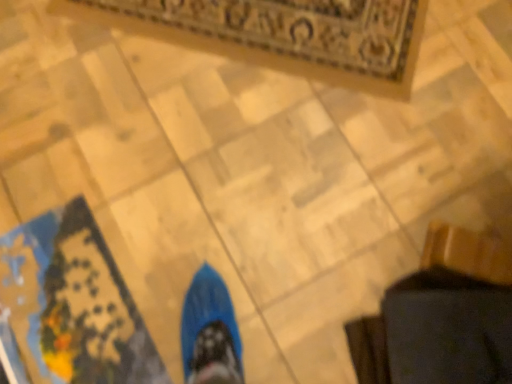
What do you see at coordinates (71, 305) in the screenshot? This screenshot has height=384, width=512. I see `blue fabric mat at lower left, placed as the second mat when sorted from back to front` at bounding box center [71, 305].

In order to face blue fabric mat at lower left, which appears as the first mat when ordered from the bottom, should I rotate leftwards or rightwards?

You should rotate left by 23.453 degrees.

Where is `blue fabric mat at lower left, acting as the first mat starting from the front`? blue fabric mat at lower left, acting as the first mat starting from the front is located at coordinates (71, 305).

Image resolution: width=512 pixels, height=384 pixels. What do you see at coordinates (283, 34) in the screenshot?
I see `carpeted mat at upper center, which is the first mat from back to front` at bounding box center [283, 34].

Identify the location of carpeted mat at upper center, which appears as the 2th mat when ordered from the bottom. This screenshot has height=384, width=512. (283, 34).

The width and height of the screenshot is (512, 384). What are the coordinates of `blue fabric mat at lower left, acting as the first mat starting from the front` in the screenshot? It's located at (71, 305).

Which is more to the right, blue fabric mat at lower left, placed as the second mat when sorted from back to front, or carpeted mat at upper center, which is the first mat from back to front?

From the viewer's perspective, carpeted mat at upper center, which is the first mat from back to front, appears more on the right side.

Does blue fabric mat at lower left, placed as the second mat when sorted from top to bottom, lie in front of carpeted mat at upper center, which appears as the 2th mat when ordered from the bottom?

Yes.

Which is behind, point (44, 313) or point (113, 20)?

Positioned behind is point (113, 20).

From the image's perspective, would you say blue fabric mat at lower left, acting as the first mat starting from the front, is positioned over carpeted mat at upper center, which is the first mat from back to front?

Actually, blue fabric mat at lower left, acting as the first mat starting from the front, appears below carpeted mat at upper center, which is the first mat from back to front, in the image.

From a real-world perspective, is blue fabric mat at lower left, placed as the second mat when sorted from top to bottom, under carpeted mat at upper center, the 1th mat viewed from the top?

No.

Does blue fabric mat at lower left, placed as the second mat when sorted from back to front, have a lesser width compared to carpeted mat at upper center, the 1th mat viewed from the top?

Yes.

Can you confirm if blue fabric mat at lower left, placed as the second mat when sorted from top to bottom, is taller than carpeted mat at upper center, which appears as the 2th mat when ordered from the bottom?

In fact, blue fabric mat at lower left, placed as the second mat when sorted from top to bottom, may be shorter than carpeted mat at upper center, which appears as the 2th mat when ordered from the bottom.

Is blue fabric mat at lower left, placed as the second mat when sorted from back to front, smaller than carpeted mat at upper center, the 1th mat viewed from the top?

Correct, blue fabric mat at lower left, placed as the second mat when sorted from back to front, occupies less space than carpeted mat at upper center, the 1th mat viewed from the top.

Choose the correct answer: Is blue fabric mat at lower left, placed as the second mat when sorted from top to bottom, inside carpeted mat at upper center, which is the first mat from back to front, or outside it?

blue fabric mat at lower left, placed as the second mat when sorted from top to bottom, is not enclosed by carpeted mat at upper center, which is the first mat from back to front.

Is blue fabric mat at lower left, which appears as the first mat when ordered from the bottom, next to carpeted mat at upper center, which is the 2th mat in front-to-back order?

No, blue fabric mat at lower left, which appears as the first mat when ordered from the bottom, is not with carpeted mat at upper center, which is the 2th mat in front-to-back order.

Is blue fabric mat at lower left, which appears as the first mat when ordered from the bottom, oriented towards carpeted mat at upper center, the 1th mat viewed from the top?

Yes, blue fabric mat at lower left, which appears as the first mat when ordered from the bottom, is turned towards carpeted mat at upper center, the 1th mat viewed from the top.

Identify the location of mat directly beneath the blue fabric mat at lower left, placed as the second mat when sorted from top to bottom (from a real-world perspective). The height and width of the screenshot is (384, 512). (283, 34).

Which object is positioned more to the left, carpeted mat at upper center, the 1th mat viewed from the top, or blue fabric mat at lower left, acting as the first mat starting from the front?

Positioned to the left is blue fabric mat at lower left, acting as the first mat starting from the front.

Consider the image. Between carpeted mat at upper center, which appears as the 2th mat when ordered from the bottom, and blue fabric mat at lower left, placed as the second mat when sorted from top to bottom, which one is positioned in front?

blue fabric mat at lower left, placed as the second mat when sorted from top to bottom, is in front.

Does point (305, 10) come in front of point (66, 325)?

No, (305, 10) is behind (66, 325).

From the image's perspective, which object appears higher, carpeted mat at upper center, which appears as the 2th mat when ordered from the bottom, or blue fabric mat at lower left, acting as the first mat starting from the front?

carpeted mat at upper center, which appears as the 2th mat when ordered from the bottom, appears higher in the image.

From a real-world perspective, which object stands above the other?

blue fabric mat at lower left, acting as the first mat starting from the front, is physically above.

Is carpeted mat at upper center, which appears as the 2th mat when ordered from the bottom, thinner than blue fabric mat at lower left, placed as the second mat when sorted from top to bottom?

In fact, carpeted mat at upper center, which appears as the 2th mat when ordered from the bottom, might be wider than blue fabric mat at lower left, placed as the second mat when sorted from top to bottom.

Which of these two, carpeted mat at upper center, which is the 2th mat in front-to-back order, or blue fabric mat at lower left, acting as the first mat starting from the front, stands taller?

With more height is carpeted mat at upper center, which is the 2th mat in front-to-back order.

Is carpeted mat at upper center, which appears as the 2th mat when ordered from the bottom, bigger than blue fabric mat at lower left, placed as the second mat when sorted from back to front?

Indeed, carpeted mat at upper center, which appears as the 2th mat when ordered from the bottom, has a larger size compared to blue fabric mat at lower left, placed as the second mat when sorted from back to front.

Choose the correct answer: Is carpeted mat at upper center, the 1th mat viewed from the top, inside blue fabric mat at lower left, which appears as the first mat when ordered from the bottom, or outside it?

carpeted mat at upper center, the 1th mat viewed from the top, exists outside the volume of blue fabric mat at lower left, which appears as the first mat when ordered from the bottom.

Are carpeted mat at upper center, which is the 2th mat in front-to-back order, and blue fabric mat at lower left, placed as the second mat when sorted from back to front, making contact?

carpeted mat at upper center, which is the 2th mat in front-to-back order, and blue fabric mat at lower left, placed as the second mat when sorted from back to front, are not in contact.

Based on the photo, is carpeted mat at upper center, which appears as the 2th mat when ordered from the bottom, positioned with its back to blue fabric mat at lower left, acting as the first mat starting from the front?

That's not correct — carpeted mat at upper center, which appears as the 2th mat when ordered from the bottom, is not looking away from blue fabric mat at lower left, acting as the first mat starting from the front.

Where is `mat above the carpeted mat at upper center, the 1th mat viewed from the top (from a real-world perspective)`? The height and width of the screenshot is (384, 512). mat above the carpeted mat at upper center, the 1th mat viewed from the top (from a real-world perspective) is located at coordinates (71, 305).

I want to click on mat on the left side of carpeted mat at upper center, the 1th mat viewed from the top, so click(71, 305).

In the image, there is a blue fabric mat at lower left, which appears as the first mat when ordered from the bottom. Where is `mat above it (from the image's perspective)`? The image size is (512, 384). mat above it (from the image's perspective) is located at coordinates (283, 34).